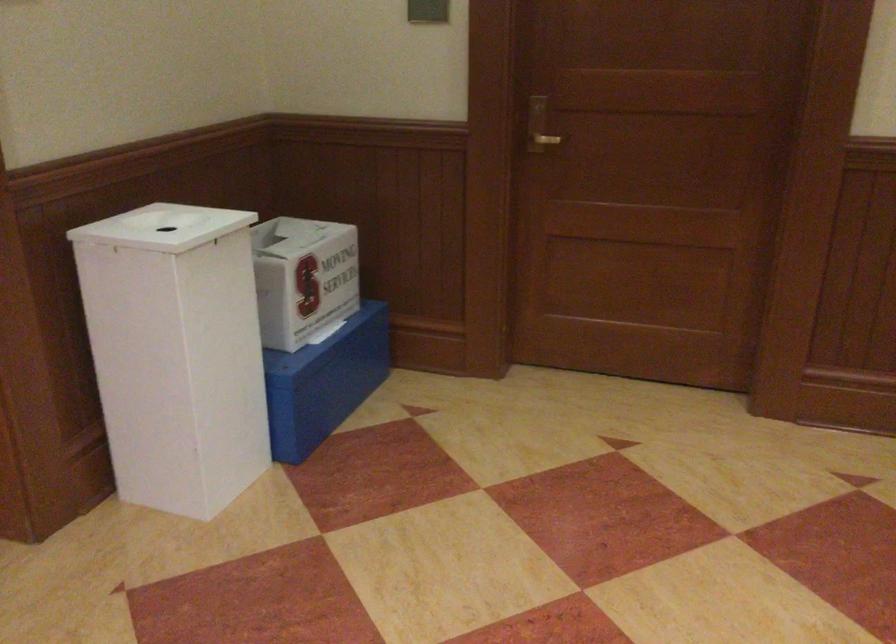
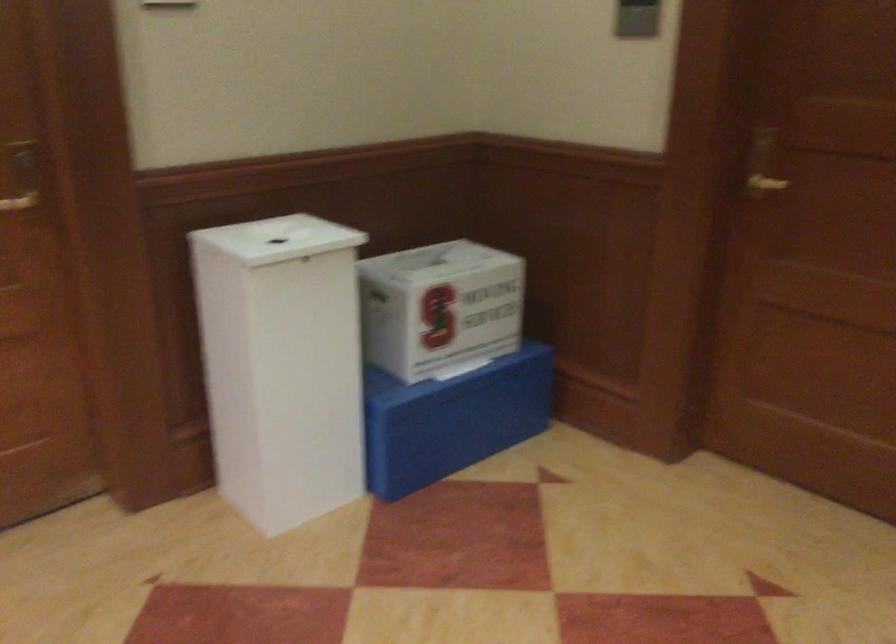
Find the pixel in the second image that matches point 304,276 in the first image.

(440, 307)